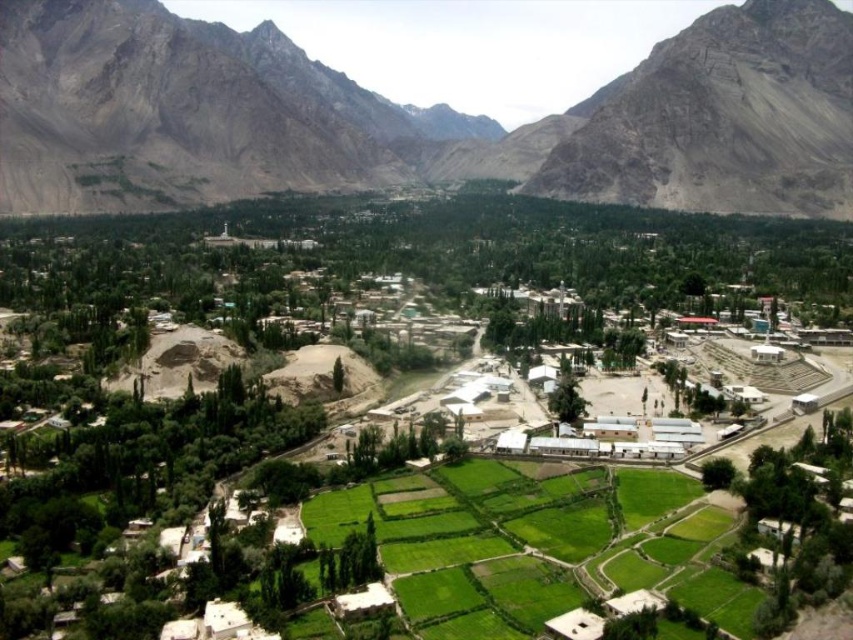
Question: Is rugged stone mountain range at center positioned at the back of brown rocky mountain at upper left?

Choices:
 (A) yes
 (B) no

Answer: (B)

Question: Is rugged stone mountain range at center positioned before brown rocky mountain at upper left?

Choices:
 (A) no
 (B) yes

Answer: (B)

Question: Which point is closer to the camera?

Choices:
 (A) (166, 54)
 (B) (602, 196)

Answer: (B)

Question: Considering the relative positions of rugged stone mountain range at center and brown rocky mountain at upper left in the image provided, where is rugged stone mountain range at center located with respect to brown rocky mountain at upper left?

Choices:
 (A) right
 (B) left

Answer: (B)